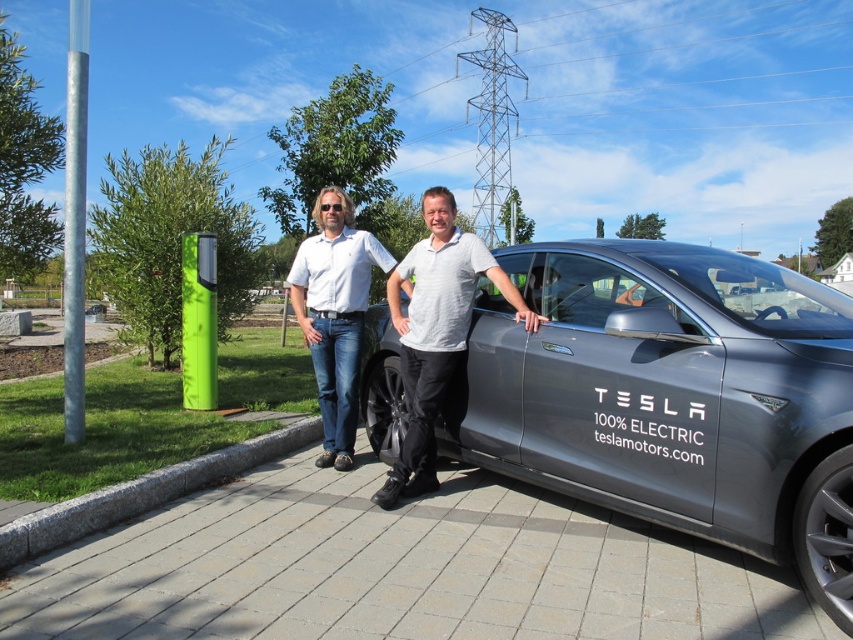
Question: Is sleek metallic tesla at center to the left of gray matte shirt at center from the viewer's perspective?

Choices:
 (A) yes
 (B) no

Answer: (B)

Question: Which object is the closest to the gray matte shirt at center?

Choices:
 (A) sleek metallic tesla at center
 (B) gray granite curb at lower center
 (C) white cotton shirt at center

Answer: (C)

Question: Where is sleek metallic tesla at center located in relation to gray matte shirt at center in the image?

Choices:
 (A) right
 (B) left

Answer: (A)

Question: Which object appears closest to the camera in this image?

Choices:
 (A) gray matte shirt at center
 (B) gray granite curb at lower center

Answer: (B)

Question: From the image, what is the correct spatial relationship of gray matte shirt at center in relation to white cotton shirt at center?

Choices:
 (A) above
 (B) below

Answer: (B)

Question: Which point is closer to the camera?

Choices:
 (A) (480, 340)
 (B) (177, 468)
 (C) (432, 268)
 (D) (339, 340)

Answer: (A)